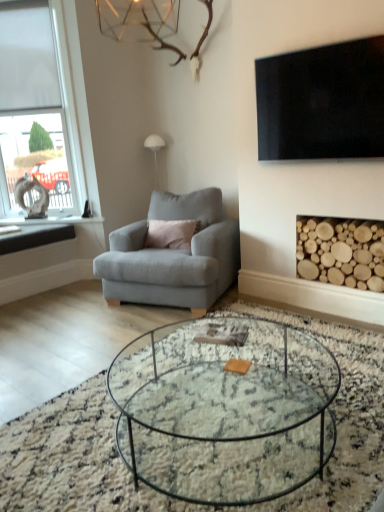
Image resolution: width=384 pixels, height=512 pixels. Describe the element at coordinates (341, 252) in the screenshot. I see `wooden logs at lower right` at that location.

The width and height of the screenshot is (384, 512). In order to click on matte gray armchair at center in this screenshot , I will do click(173, 254).

What do you see at coordinates (322, 102) in the screenshot? I see `black glossy tv at upper right` at bounding box center [322, 102].

Identify the location of black glossy tv at upper right. (322, 102).

Where is `clear glass coffee table at center`? Image resolution: width=384 pixels, height=512 pixels. clear glass coffee table at center is located at coordinates (225, 409).

From a real-world perspective, is matte gray armchair at center physically below wooden logs at lower right?

Yes, from a real-world perspective, matte gray armchair at center is below wooden logs at lower right.

Is point (236, 238) more distant than point (361, 220)?

Yes.

Is matte gray armchair at center spatially inside wooden logs at lower right, or outside of it?

The correct answer is: outside.

Between matte gray armchair at center and wooden logs at lower right, which one has smaller size?

wooden logs at lower right.

How distant is wooden logs at lower right from white frosted glass window at left?

The distance of wooden logs at lower right from white frosted glass window at left is 8.43 feet.

Image resolution: width=384 pixels, height=512 pixels. Identify the location of fireplace located on the right of white frosted glass window at left. coord(341,252).

How many degrees apart are the facing directions of wooden logs at lower right and white frosted glass window at left?

33.5 degrees separate the facing orientations of wooden logs at lower right and white frosted glass window at left.

Which object is positioned more to the left, wooden logs at lower right or white frosted glass window at left?

white frosted glass window at left.

From a real-world perspective, which is physically below, black glossy tv at upper right or white frosted glass window at left?

In real-world perspective, black glossy tv at upper right is lower.

In terms of height, does black glossy tv at upper right look taller or shorter compared to white frosted glass window at left?

black glossy tv at upper right is shorter than white frosted glass window at left.

Between black glossy tv at upper right and white frosted glass window at left, which one appears on the left side from the viewer's perspective?

Positioned to the left is white frosted glass window at left.

Can you see black glossy tv at upper right touching white frosted glass window at left?

No, black glossy tv at upper right is not next to white frosted glass window at left.

Which is more to the right, black stone window sill at left or clear glass coffee table at center?

From the viewer's perspective, clear glass coffee table at center appears more on the right side.

From the picture: From the image's perspective, which one is positioned lower, black stone window sill at left or clear glass coffee table at center?

clear glass coffee table at center appears lower in the image.

Is black stone window sill at left oriented towards clear glass coffee table at center?

No.

From a real-world perspective, is black stone window sill at left located higher than clear glass coffee table at center?

Yes, from a real-world perspective, black stone window sill at left is over clear glass coffee table at center

Would you consider black stone window sill at left to be distant from wooden logs at lower right?

black stone window sill at left is positioned a significant distance from wooden logs at lower right.

Which object is wider, black stone window sill at left or wooden logs at lower right?

black stone window sill at left.

Identify the location of window sill behind the wooden logs at lower right. The image size is (384, 512). click(74, 231).

Are wooden logs at lower right and black glossy tv at upper right located far from each other?

No, there isn't a large distance between wooden logs at lower right and black glossy tv at upper right.

Which is less distant, (382, 285) or (277, 132)?

Point (382, 285) appears to be closer to the viewer than point (277, 132).

Is wooden logs at lower right completely or partially outside of black glossy tv at upper right?

wooden logs at lower right lies outside black glossy tv at upper right's area.

You are a GUI agent. You are given a task and a screenshot of the screen. Output one action in this format:
    pyautogui.click(x=<x>, y=<y>)
    Task: Click on the chair positioned vertically above the clear glass coffee table at center (from a real-world perspective)
    The width and height of the screenshot is (384, 512).
    Given the screenshot: What is the action you would take?
    pyautogui.click(x=173, y=254)

Between matte gray armchair at center and clear glass coffee table at center, which one is positioned in front?

clear glass coffee table at center is closer to the camera.

Considering the points (153, 288) and (320, 376), which point is behind, point (153, 288) or point (320, 376)?

The point (153, 288) is more distant.

Is matte gray armchair at center wider than clear glass coffee table at center?

Incorrect, the width of matte gray armchair at center does not surpass that of clear glass coffee table at center.

Image resolution: width=384 pixels, height=512 pixels. I want to click on fireplace lying on the right of matte gray armchair at center, so click(341, 252).

You are a GUI agent. You are given a task and a screenshot of the screen. Output one action in this format:
    pyautogui.click(x=<x>, y=<y>)
    Task: Click on the fireplace in front of the white frosted glass window at left
    The width and height of the screenshot is (384, 512).
    Given the screenshot: What is the action you would take?
    pyautogui.click(x=341, y=252)

Based on their spatial positions, is black stone window sill at left or black glossy tv at upper right further from white frosted glass window at left?

black glossy tv at upper right is further to white frosted glass window at left.

Considering their positions, is wooden logs at lower right positioned closer to black stone window sill at left than clear glass coffee table at center?

The object closer to black stone window sill at left is wooden logs at lower right.

Based on their spatial positions, is white frosted glass window at left or wooden logs at lower right closer to matte gray armchair at center?

The object closer to matte gray armchair at center is wooden logs at lower right.

Looking at this image, when comparing their distances from white frosted glass window at left, does matte gray armchair at center or black glossy tv at upper right seem further?

black glossy tv at upper right is further to white frosted glass window at left.

Estimate the real-world distances between objects in this image. Which object is closer to wooden logs at lower right, black glossy tv at upper right or clear glass coffee table at center?

black glossy tv at upper right lies closer to wooden logs at lower right than the other object.

Considering their positions, is wooden logs at lower right positioned closer to white frosted glass window at left than clear glass coffee table at center?

Among the two, wooden logs at lower right is located nearer to white frosted glass window at left.

From the image, which object appears to be farther from matte gray armchair at center, black glossy tv at upper right or clear glass coffee table at center?

Among the two, clear glass coffee table at center is located further to matte gray armchair at center.

When comparing their distances from wooden logs at lower right, does black stone window sill at left or clear glass coffee table at center seem further?

black stone window sill at left.

I want to click on chair positioned between clear glass coffee table at center and black stone window sill at left from near to far, so click(173, 254).

The image size is (384, 512). Find the location of `chair positioned between clear glass coffee table at center and white frosted glass window at left from near to far`. chair positioned between clear glass coffee table at center and white frosted glass window at left from near to far is located at coordinates (173, 254).

What are the coordinates of `window between black stone window sill at left and black glossy tv at upper right from left to right` in the screenshot? It's located at (38, 108).

Locate an element on the screen. This screenshot has height=512, width=384. television between clear glass coffee table at center and matte gray armchair at center along the z-axis is located at coordinates (322, 102).